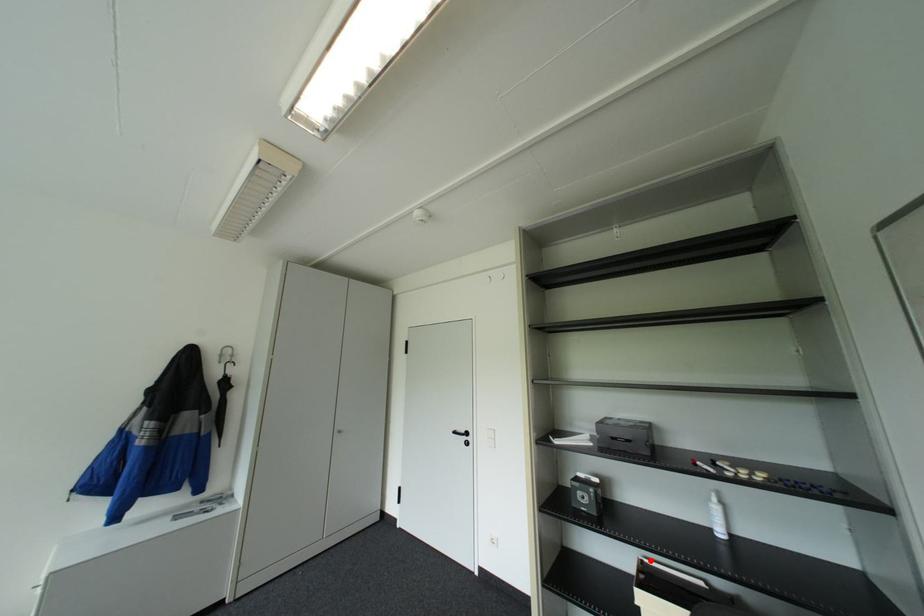
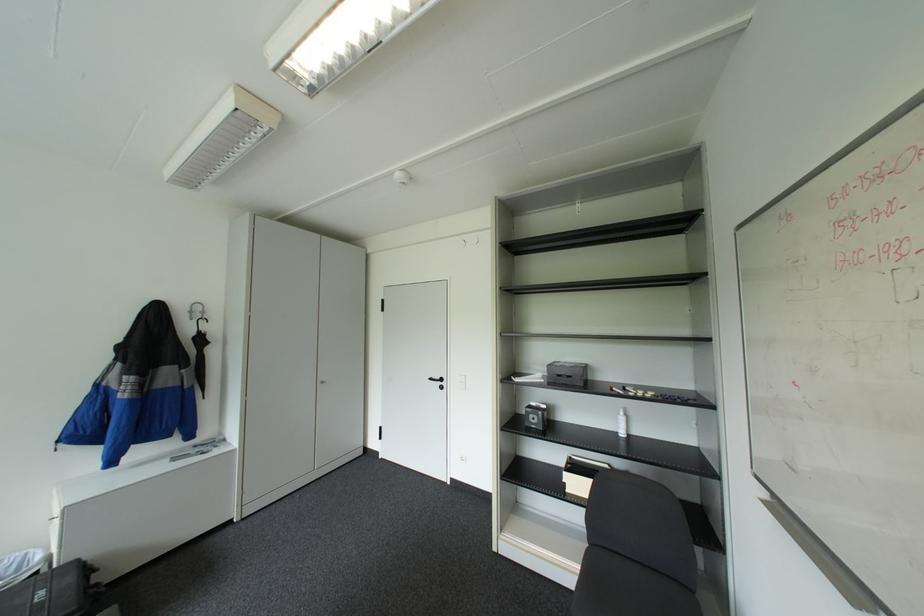
The point at the highlighted location is marked in the first image. Where is the corresponding point in the second image?

(578, 456)